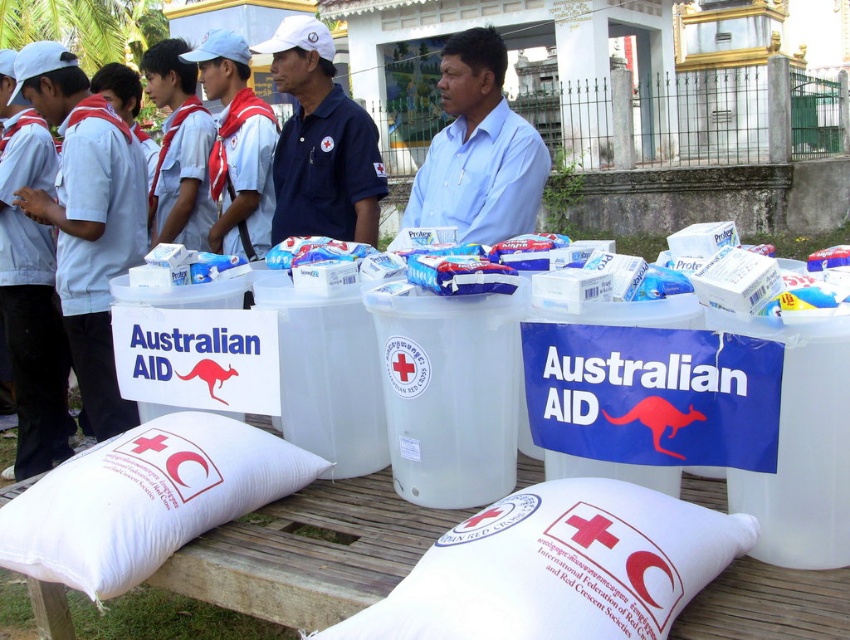
From the picture: Is white fabric pillow at lower center thinner than white fabric pillow at lower left?

No.

Who is taller, white fabric pillow at lower center or white fabric pillow at lower left?

white fabric pillow at lower left is taller.

Who is more forward, (629,618) or (44,529)?

Point (629,618)

Find the location of `white fabric pillow at lower center`. white fabric pillow at lower center is located at coordinates (559, 566).

Which is behind, point (250, 490) or point (251, 148)?

Positioned behind is point (251, 148).

Which is more to the right, white fabric pillow at lower left or white cotton shirt at center?

Positioned to the right is white fabric pillow at lower left.

Is point (105, 472) in front of point (253, 120)?

Yes, point (105, 472) is in front of point (253, 120).

The width and height of the screenshot is (850, 640). I want to click on white fabric pillow at lower left, so click(x=145, y=499).

Can you confirm if white fabric pillow at lower left is smaller than matte blue polo shirt at center?

Correct, white fabric pillow at lower left occupies less space than matte blue polo shirt at center.

Between point (162, 556) and point (327, 81), which one is positioned in front?

Point (162, 556) is in front.

In order to click on white fabric pillow at lower left in this screenshot , I will do `click(145, 499)`.